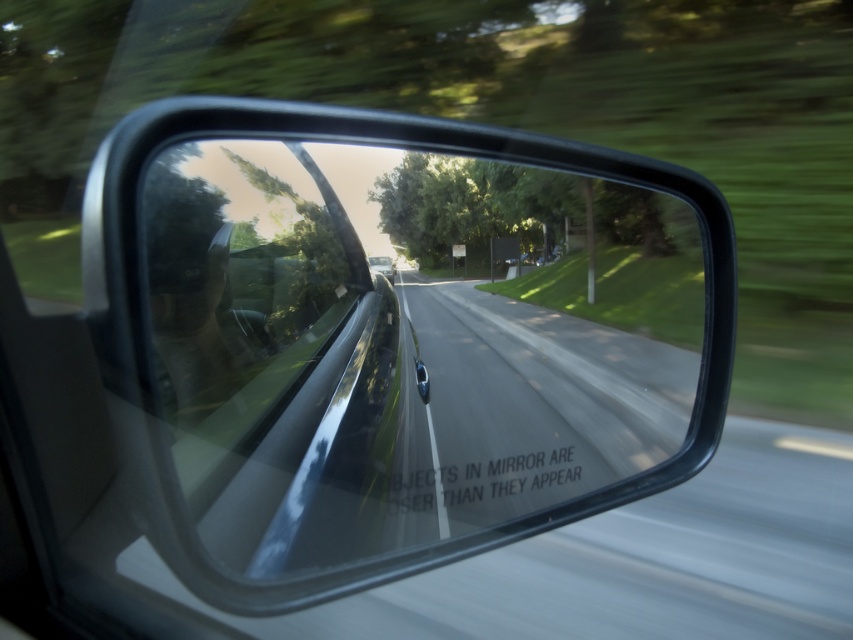
Question: Can you confirm if asphalt road at center is bigger than metallic silver car at center?

Choices:
 (A) yes
 (B) no

Answer: (A)

Question: Based on their relative distances, which object is nearer to the metallic silver car at center?

Choices:
 (A) asphalt road at center
 (B) glossy metallic mirror at center

Answer: (B)

Question: Which object is the farthest from the glossy metallic mirror at center?

Choices:
 (A) asphalt road at center
 (B) metallic silver car at center

Answer: (B)

Question: Is glossy metallic mirror at center to the left of asphalt road at center from the viewer's perspective?

Choices:
 (A) no
 (B) yes

Answer: (A)

Question: Is the position of asphalt road at center more distant than that of metallic silver car at center?

Choices:
 (A) yes
 (B) no

Answer: (B)

Question: Which of the following is the closest to the observer?

Choices:
 (A) [650, 401]
 (B) [561, 246]
 (C) [370, 268]

Answer: (A)